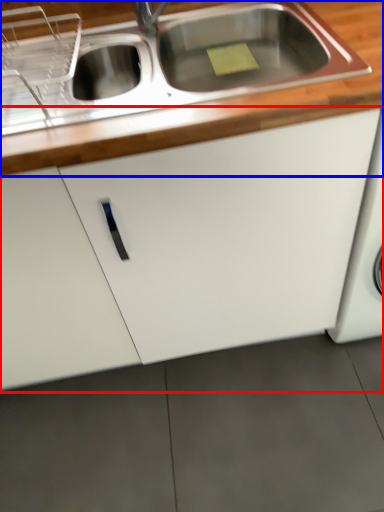
Question: Which point is further to the camera, cabinetry (highlighted by a red box) or countertop (highlighted by a blue box)?

Choices:
 (A) cabinetry
 (B) countertop

Answer: (A)